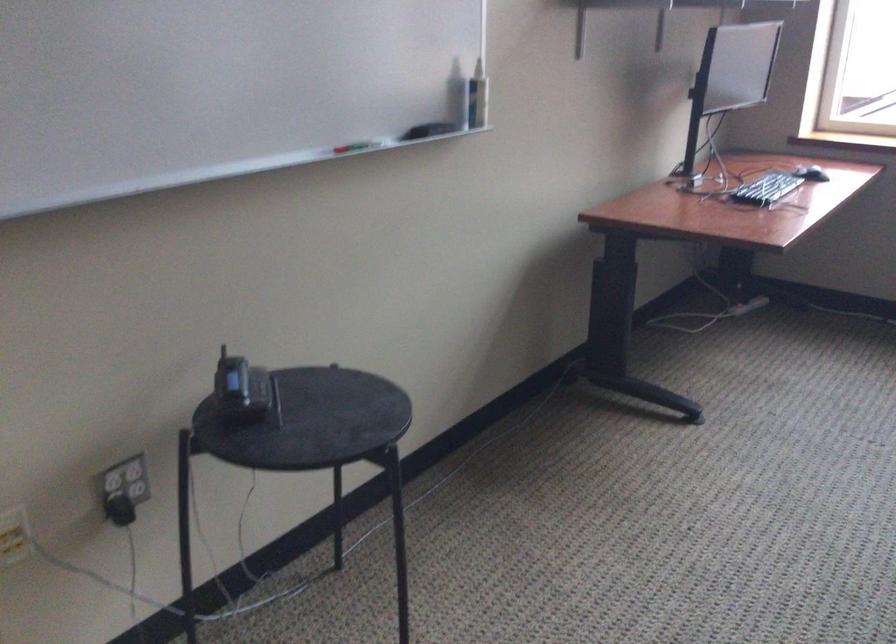
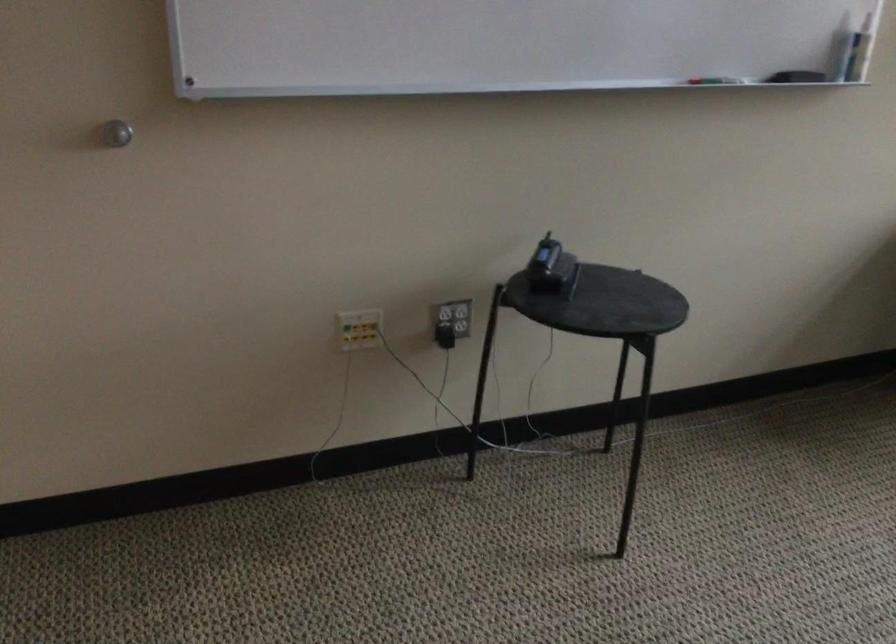
Locate, in the second image, the point that corresponds to point 363,154 in the first image.

(714, 80)